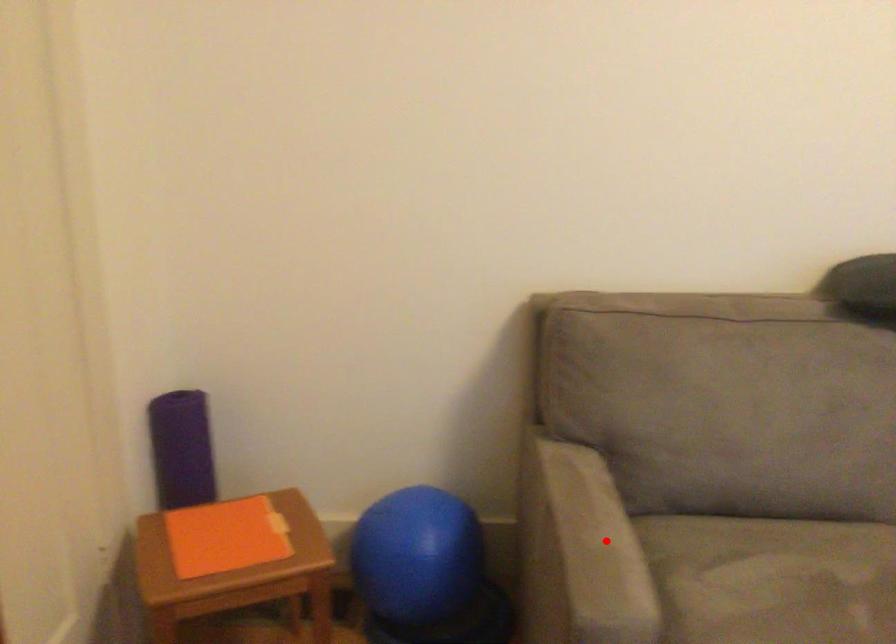
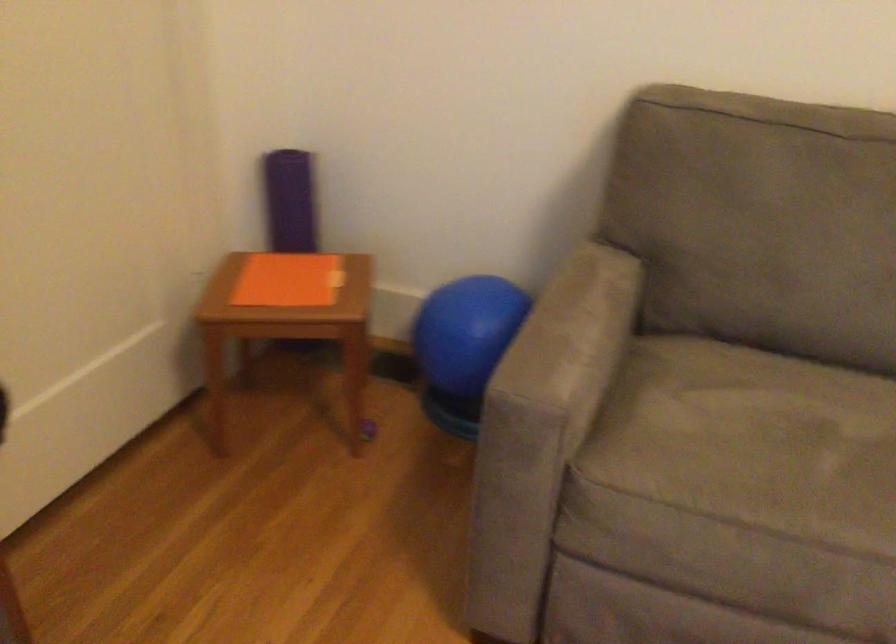
Where in the second image is the point corresponding to the highlighted location from the first image?

(572, 333)